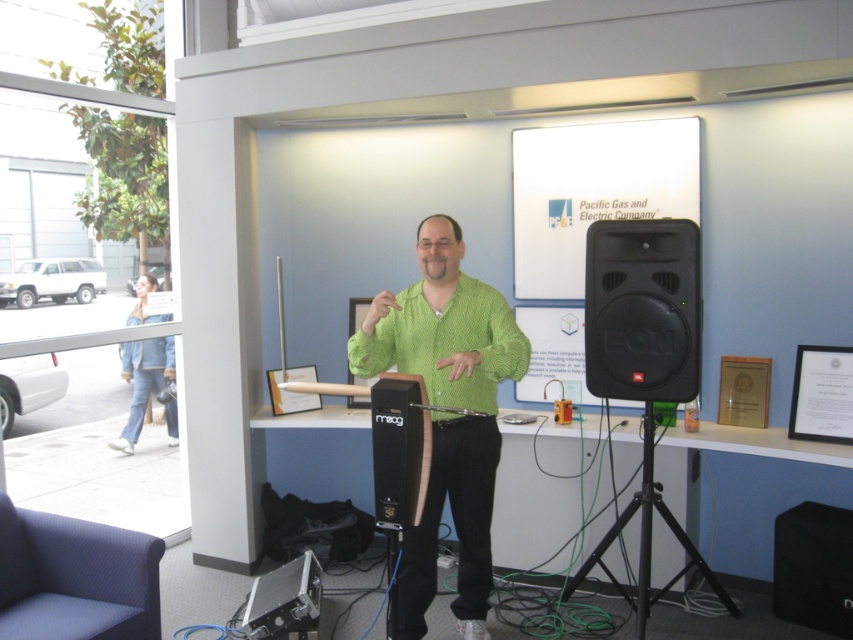
You are an event organizer who needs to set up a stage for a presentation. The presenter will wear the green textured shirt at center and stand next to the black plastic speaker at right. Based on their heights, which one should be placed on the stage first to ensure proper visibility?

The green textured shirt at center has a greater height compared to the black plastic speaker at right, so the presenter wearing the green textured shirt at center should be placed on the stage first to ensure they are visible over the speaker.

You are an event planner setting up a presentation. You need to ensure that the green textured shirt at center and the black plastic speaker at right are visible to the audience. Based on their positions, which object is closer to the front of the stage?

The green textured shirt at center is located below the black plastic speaker at right, meaning it is positioned closer to the front of the stage compared to the speaker which is placed further back.

You are setting up for an event and need to place the black plastic speaker at right and the black matte tripod at lower right in a limited space. Based on their sizes, which object should you prioritize placing first to ensure both fit?

The black plastic speaker at right occupies less space than the black matte tripod at lower right, so you should prioritize placing the larger black matte tripod at lower right first to ensure both fit in the limited space.